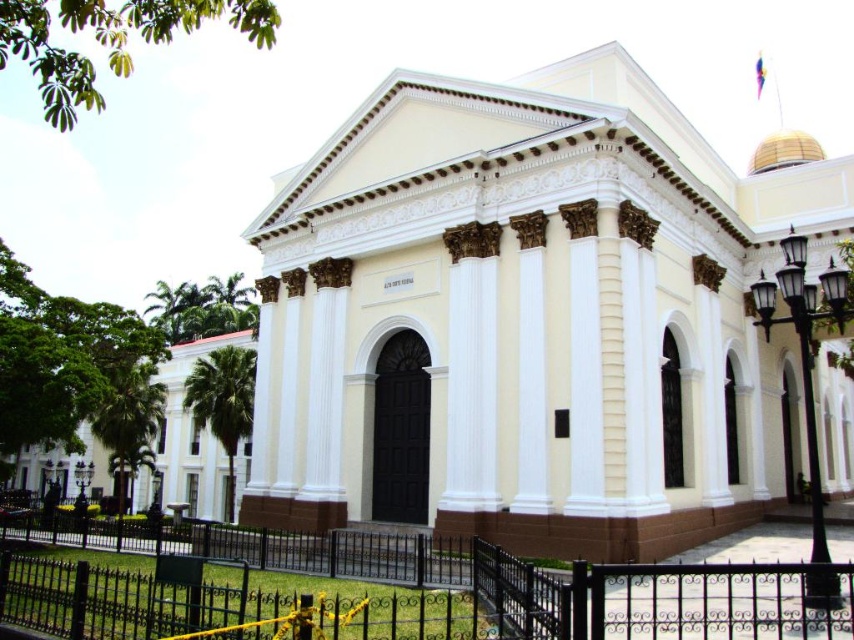
Question: Which object is farther from the camera taking this photo?

Choices:
 (A) white smooth building at center
 (B) black wrought iron fence at lower center

Answer: (A)

Question: Does white smooth building at center have a larger size compared to black wrought iron fence at lower center?

Choices:
 (A) yes
 (B) no

Answer: (A)

Question: Can you confirm if white smooth building at center is positioned above black wrought iron fence at lower center?

Choices:
 (A) yes
 (B) no

Answer: (A)

Question: Is white smooth building at center positioned before black wrought iron fence at lower center?

Choices:
 (A) yes
 (B) no

Answer: (B)

Question: Which point is farther to the camera?

Choices:
 (A) white smooth building at center
 (B) black wrought iron fence at lower center

Answer: (A)

Question: Which object is farther from the camera taking this photo?

Choices:
 (A) white smooth building at center
 (B) black wrought iron fence at lower center

Answer: (A)